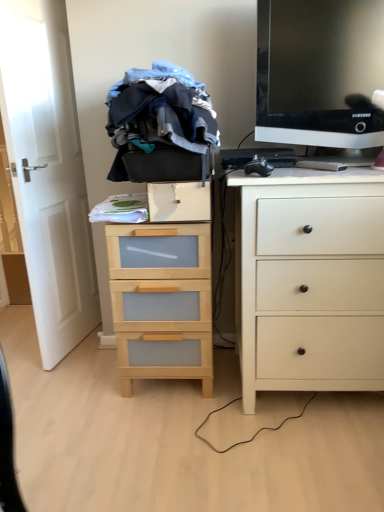
Image resolution: width=384 pixels, height=512 pixels. Find the location of `vacant area that is in front of wooden chest of drawers at center, marked as the second chest of drawers in a right-to-left arrangement`. vacant area that is in front of wooden chest of drawers at center, marked as the second chest of drawers in a right-to-left arrangement is located at coordinates [172, 435].